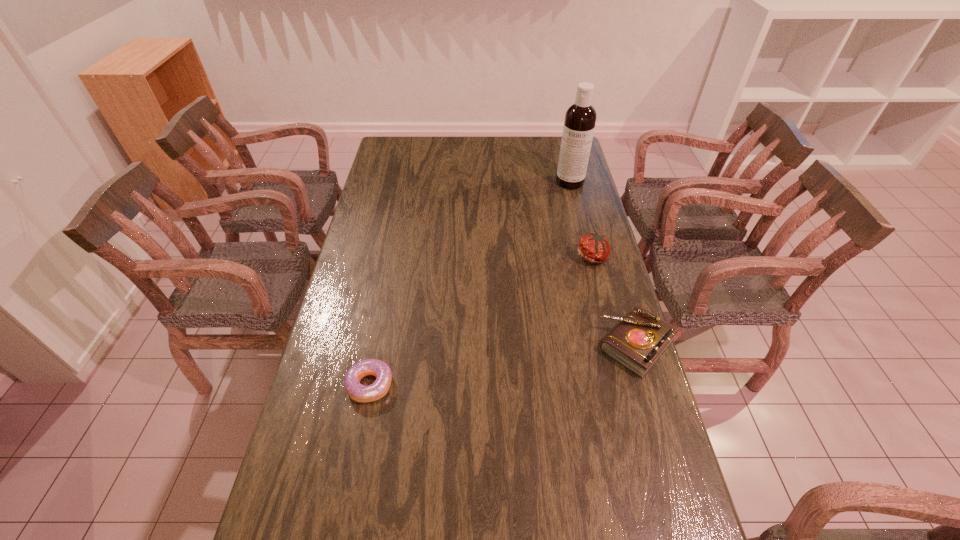
You are a GUI agent. You are given a task and a screenshot of the screen. Output one action in this format:
    pyautogui.click(x=<x>, y=<y>)
    Task: Click on the vacant space that is in between the third shortest object and the third tallest object
    Image resolution: width=960 pixels, height=540 pixels.
    Given the screenshot: What is the action you would take?
    pyautogui.click(x=615, y=301)

The width and height of the screenshot is (960, 540). I want to click on free space between the diary and the second tallest object, so pos(615,301).

At what (x,y) coordinates should I click in order to perform the action: click on vacant area between the diary and the shortest object. Please return your answer as a coordinate pair (x, y). Looking at the image, I should click on (503, 365).

At what (x,y) coordinates should I click in order to perform the action: click on unoccupied position between the third tallest object and the second tallest object. Please return your answer as a coordinate pair (x, y). The image size is (960, 540). Looking at the image, I should click on (615, 301).

Where is `object that is the second nearest to the doughnut`? object that is the second nearest to the doughnut is located at coordinates (594, 248).

Identify which object is the second closest to the second farthest object. Please provide its 2D coordinates. Your answer should be formatted as a tuple, i.e. [(x, y)], where the tuple contains the x and y coordinates of a point satisfying the conditions above.

[(580, 118)]

I want to click on free space that satisfies the following two spatial constraints: 1. on the front side of the second tallest object; 2. on the right side of the diary, so click(x=616, y=345).

At what (x,y) coordinates should I click in order to perform the action: click on vacant area that satisfies the following two spatial constraints: 1. on the front side of the farthest object; 2. on the left side of the third nearest object. Please return your answer as a coordinate pair (x, y). This screenshot has height=540, width=960. Looking at the image, I should click on 588,257.

In order to click on vacant area in the image that satisfies the following two spatial constraints: 1. on the back side of the shortest object; 2. on the left side of the third shortest object in this screenshot , I will do `click(395, 257)`.

Where is `free space that satisfies the following two spatial constraints: 1. on the back side of the dishwasher detergent; 2. on the left side of the doughnut`? This screenshot has width=960, height=540. free space that satisfies the following two spatial constraints: 1. on the back side of the dishwasher detergent; 2. on the left side of the doughnut is located at coordinates (409, 182).